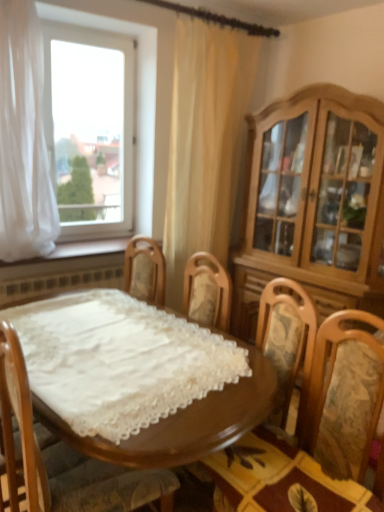
Question: Should I look upward or downward to see wooden swivel chair at center?

Choices:
 (A) down
 (B) up

Answer: (A)

Question: Considering the relative positions of transparent glass window at upper left and wooden at lower left in the image provided, is transparent glass window at upper left behind wooden at lower left?

Choices:
 (A) yes
 (B) no

Answer: (A)

Question: Is transparent glass window at upper left aimed at wooden at lower left?

Choices:
 (A) yes
 (B) no

Answer: (A)

Question: Can you confirm if transparent glass window at upper left is taller than wooden at lower left?

Choices:
 (A) yes
 (B) no

Answer: (A)

Question: From a real-world perspective, is transparent glass window at upper left on top of wooden at lower left?

Choices:
 (A) yes
 (B) no

Answer: (A)

Question: From the image's perspective, is transparent glass window at upper left below wooden at lower left?

Choices:
 (A) no
 (B) yes

Answer: (A)

Question: Does transparent glass window at upper left touch wooden at lower left?

Choices:
 (A) yes
 (B) no

Answer: (B)

Question: Are light brown wood cabinet at right and wooden table at center making contact?

Choices:
 (A) yes
 (B) no

Answer: (B)

Question: From a real-world perspective, is light brown wood cabinet at right on wooden table at center?

Choices:
 (A) no
 (B) yes

Answer: (B)

Question: Is the position of light brown wood cabinet at right less distant than that of wooden table at center?

Choices:
 (A) no
 (B) yes

Answer: (A)

Question: Can you confirm if light brown wood cabinet at right is positioned to the left of wooden table at center?

Choices:
 (A) no
 (B) yes

Answer: (A)

Question: From a real-world perspective, is light brown wood cabinet at right under wooden table at center?

Choices:
 (A) no
 (B) yes

Answer: (A)

Question: From the image's perspective, would you say light brown wood cabinet at right is shown under wooden table at center?

Choices:
 (A) yes
 (B) no

Answer: (B)

Question: Can you confirm if light brown wood cabinet at right is bigger than wooden chair with floral cushion at center?

Choices:
 (A) no
 (B) yes

Answer: (B)